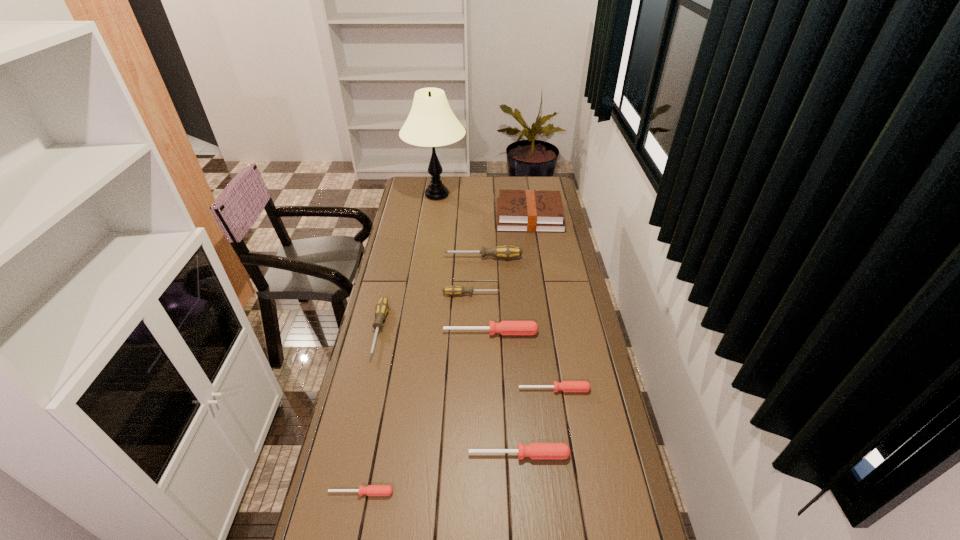
Where is `object that is positioned at the far left corner`? This screenshot has width=960, height=540. object that is positioned at the far left corner is located at coordinates (431, 123).

This screenshot has width=960, height=540. Identify the location of vacant region at the left edge. (415, 262).

This screenshot has height=540, width=960. I want to click on vacant space at the right edge of the desktop, so click(x=570, y=316).

I want to click on vacant space at the far left corner, so click(x=426, y=180).

The width and height of the screenshot is (960, 540). In order to click on vacant point at the far right corner in this screenshot , I will do `click(527, 186)`.

Find the location of `vacant area that lies between the shortest screwdriver and the second biggest gray screwdriver`. vacant area that lies between the shortest screwdriver and the second biggest gray screwdriver is located at coordinates (371, 411).

Where is `free spot between the farthest red screwdriver and the farthest gray screwdriver`? This screenshot has height=540, width=960. free spot between the farthest red screwdriver and the farthest gray screwdriver is located at coordinates (487, 295).

Where is `free space between the eighth shortest object and the second biggest gray screwdriver`? The height and width of the screenshot is (540, 960). free space between the eighth shortest object and the second biggest gray screwdriver is located at coordinates (454, 274).

Find the location of a particular element. free space between the second nearest object and the smallest red screwdriver is located at coordinates (441, 474).

At what (x,y) coordinates should I click in order to perform the action: click on vacant area that lies between the lamp and the hardback book. Please return your answer as a coordinate pair (x, y). This screenshot has width=960, height=540. Looking at the image, I should click on (483, 206).